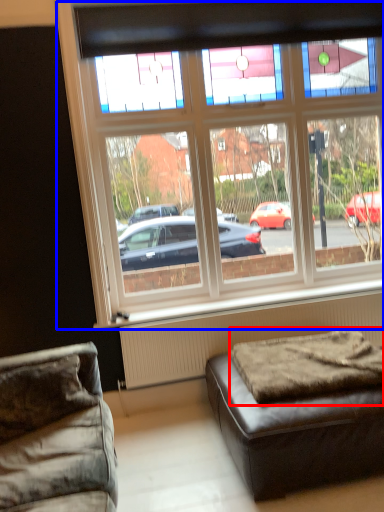
Question: Among these objects, which one is nearest to the camera, mattress (highlighted by a red box) or window (highlighted by a blue box)?

Choices:
 (A) mattress
 (B) window

Answer: (A)